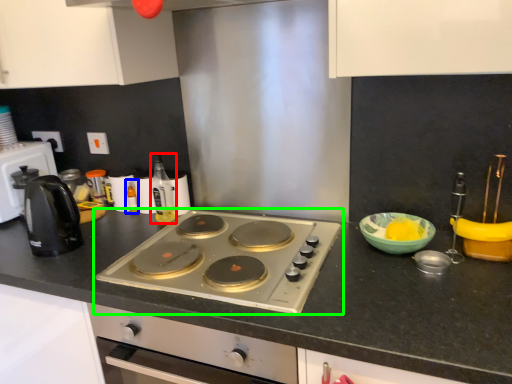
Question: Considering the real-world distances, which object is farthest from bottle (highlighted by a red box)? bottle (highlighted by a blue box) or gas stove (highlighted by a green box)?

Choices:
 (A) bottle
 (B) gas stove

Answer: (B)